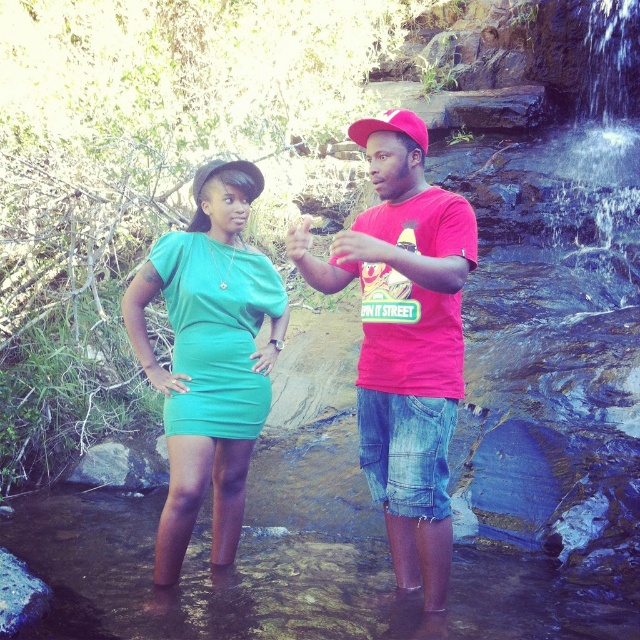
You are a photographer trying to capture the scene with a camera. You notice the point at coordinates (x=404, y=352). What object is located there?

The point at coordinates (x=404, y=352) has the matte red t shirt at center.